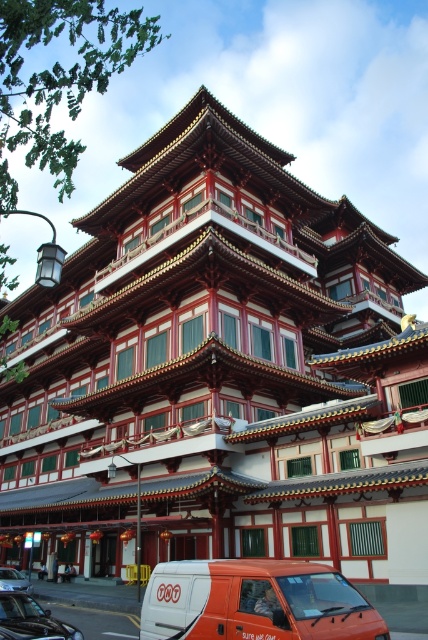
Between orange matte van at lower center and shiny black car at lower left, which one appears on the left side from the viewer's perspective?

shiny black car at lower left

Locate an element on the screen. Image resolution: width=428 pixels, height=640 pixels. orange matte van at lower center is located at coordinates (255, 602).

At what (x,y) coordinates should I click in order to perform the action: click on orange matte van at lower center. Please return your answer as a coordinate pair (x, y). Looking at the image, I should click on (255, 602).

Does point (360, 595) come in front of point (14, 584)?

Yes, it is.

Is point (162, 573) more distant than point (14, 589)?

That is False.

Where is `orange matte van at lower center`? orange matte van at lower center is located at coordinates pos(255,602).

Between shiny black car at lower left and metallic silver van at lower left, which one is positioned higher?

shiny black car at lower left

Who is more forward, (x=74, y=627) or (x=11, y=582)?

Positioned in front is point (x=74, y=627).

Between point (0, 598) and point (6, 584), which one is positioned in front?

Point (0, 598) is in front.

Locate an element on the screen. This screenshot has height=640, width=428. shiny black car at lower left is located at coordinates (30, 620).